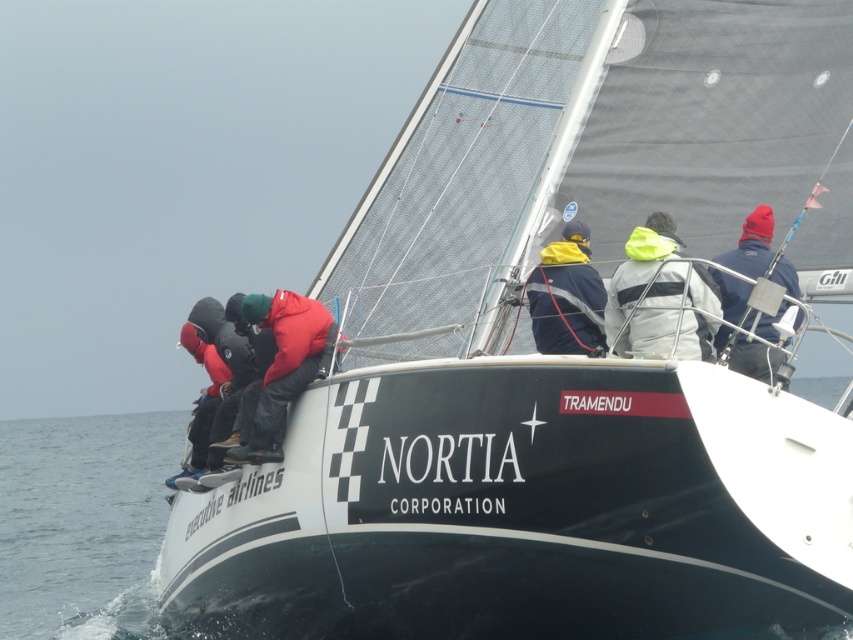
You are standing on the deck of the sailboat named Nortia Corporation. You see the transparent water at lower left and the dark blue and yellow jacket at center. Which object is nearer to you?

The transparent water at lower left is closer to the viewer than the dark blue and yellow jacket at center.

You are a passenger on the Nortia Corporation sailboat and notice the neon yellow jacket at center and the transparent water at lower left. Which object is closer to the front of the boat?

The neon yellow jacket at center is closer to the front of the boat because the transparent water at lower left is positioned under it, indicating it is further back.